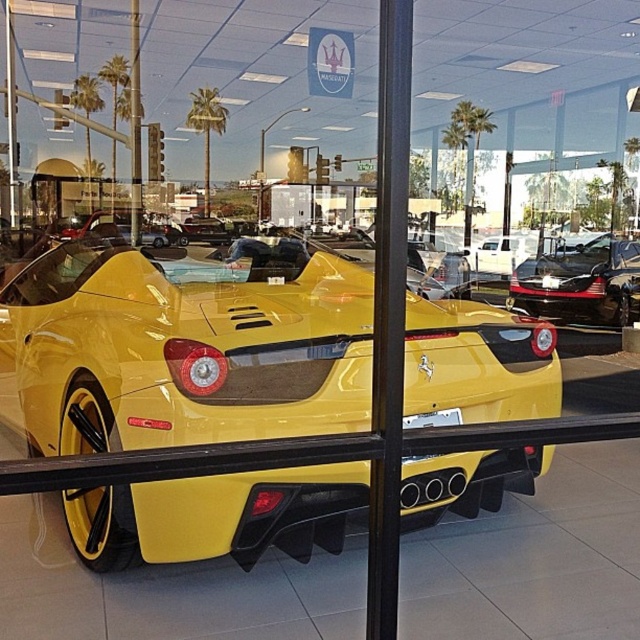
Which is behind, point (225, 321) or point (540, 291)?

Point (540, 291)

Can you confirm if yellow matte sports car at center is positioned to the left of shiny black car at center?

Correct, you'll find yellow matte sports car at center to the left of shiny black car at center.

Does point (228, 282) come behind point (552, 292)?

No, (228, 282) is in front of (552, 292).

Locate an element on the screen. This screenshot has height=640, width=640. yellow matte sports car at center is located at coordinates (182, 348).